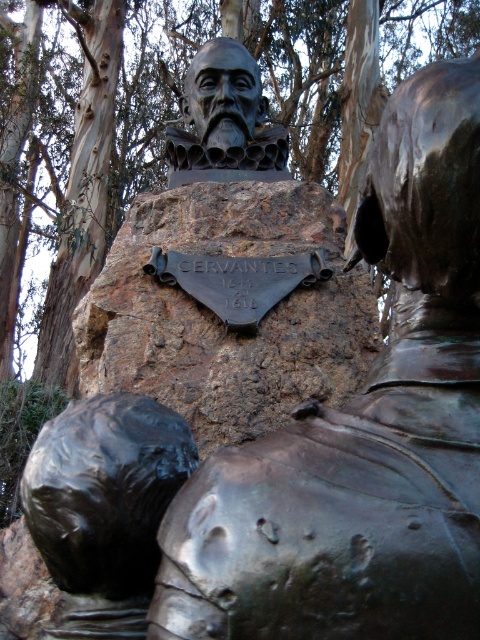
You are an art student observing the sculpture of Cervantes. You notice the shiny black helmet at lower left and the brown rough stone at center. Which object is closer to you?

The brown rough stone at center is closer to you because the shiny black helmet at lower left is behind it.

Based on the scene description, can you determine which object is wider between the brown rough stone at center and the shiny black helmet at lower left?

The brown rough stone at center is wider than the shiny black helmet at lower left according to the description.